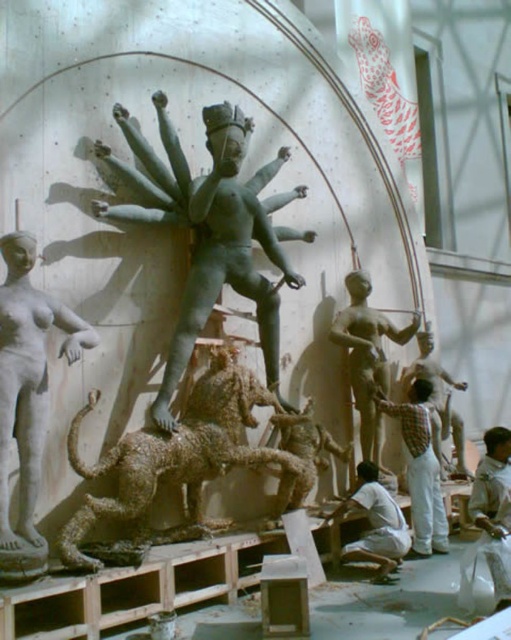
In the scene shown: Who is positioned more to the left, rusty wireframe horse at center or bronze statue at right?

Positioned to the left is rusty wireframe horse at center.

From the picture: Is rusty wireframe horse at center thinner than bronze statue at right?

Indeed, rusty wireframe horse at center has a lesser width compared to bronze statue at right.

This screenshot has width=511, height=640. In order to click on rusty wireframe horse at center in this screenshot , I will do `click(174, 465)`.

Based on the photo, can you confirm if bronze statue at center is shorter than plaid shirt at center?

Yes.

Does bronze statue at center have a larger size compared to plaid shirt at center?

Actually, bronze statue at center might be smaller than plaid shirt at center.

Is point (193, 342) farther from viewer compared to point (443, 506)?

No, it is not.

Where is `bronze statue at center`? Image resolution: width=511 pixels, height=640 pixels. bronze statue at center is located at coordinates (208, 228).

What are the coordinates of `bronze statue at right` in the screenshot? It's located at (367, 355).

Image resolution: width=511 pixels, height=640 pixels. I want to click on bronze statue at right, so click(x=367, y=355).